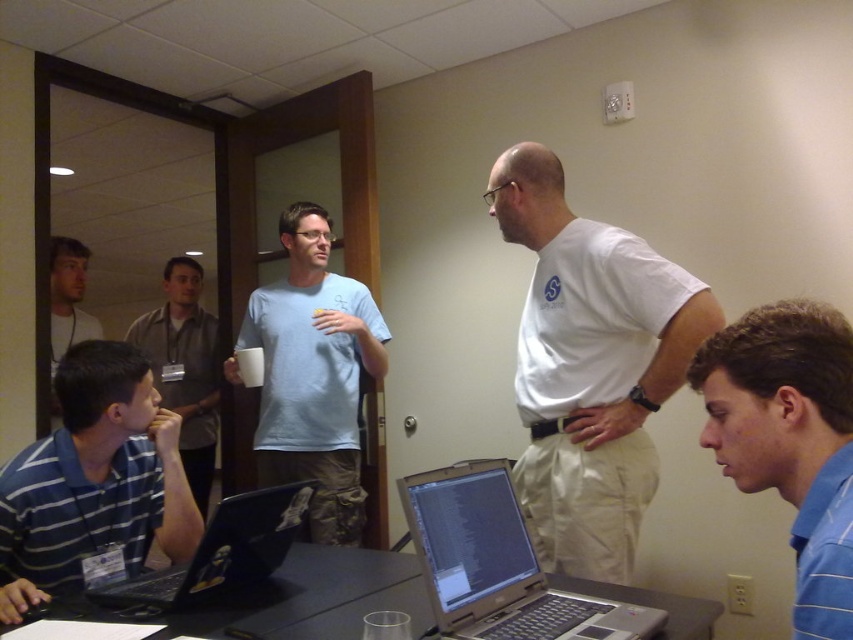
Question: Which point is farther to the camera?

Choices:
 (A) black matte laptop at lower left
 (B) blue striped shirt at left
 (C) gray fabric shirt at left

Answer: (C)

Question: Which of the following is the farthest from the observer?

Choices:
 (A) (550, 608)
 (B) (552, 195)
 (C) (177, 524)

Answer: (B)

Question: Is light blue t-shirt at center bigger than silver metallic laptop at center?

Choices:
 (A) yes
 (B) no

Answer: (A)

Question: Does blue striped shirt at lower right have a larger size compared to black plastic table at center?

Choices:
 (A) no
 (B) yes

Answer: (A)

Question: Which point is closer to the camera?

Choices:
 (A) coord(625,420)
 (B) coord(264,596)

Answer: (B)

Question: Is the position of blue striped shirt at left more distant than that of matte gray shirt at upper left?

Choices:
 (A) no
 (B) yes

Answer: (A)